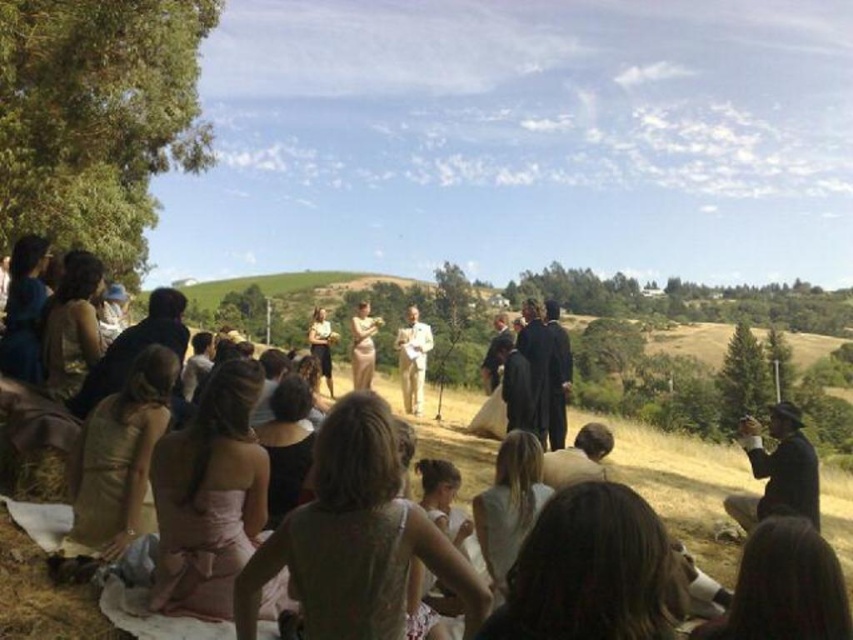
Question: Is matte white dress at center bigger than black leather hat at lower right?

Choices:
 (A) no
 (B) yes

Answer: (B)

Question: Among these objects, which one is nearest to the camera?

Choices:
 (A) light beige suit at center
 (B) black leather hat at lower right
 (C) matte white dress at center

Answer: (C)

Question: Which of the following is the farthest from the observer?

Choices:
 (A) matte white dress at center
 (B) light beige suit at center

Answer: (B)

Question: Which point appears closest to the camera in this image?

Choices:
 (A) (24, 620)
 (B) (798, 512)

Answer: (A)

Question: Is the position of matte white dress at center more distant than that of light beige suit at center?

Choices:
 (A) no
 (B) yes

Answer: (A)

Question: Is matte white dress at center wider than black leather hat at lower right?

Choices:
 (A) no
 (B) yes

Answer: (B)